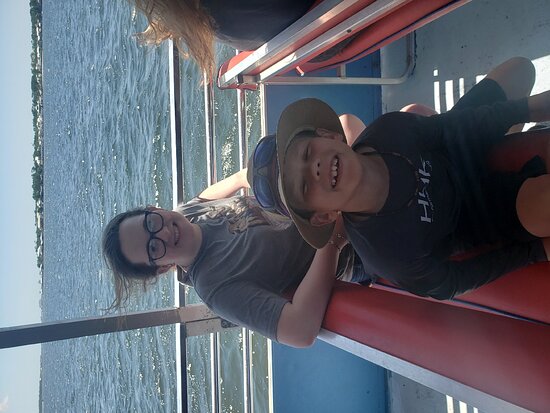
This screenshot has height=413, width=550. What are the coordinates of `bench seat` in the screenshot? It's located at (382, 320), (531, 288), (529, 352).